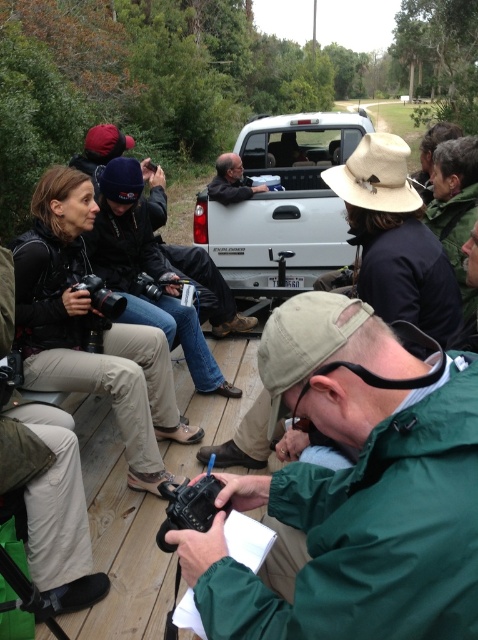
Question: Estimate the real-world distances between objects in this image. Which object is farther from the matte black shirt at center?

Choices:
 (A) green matte jacket at lower right
 (B) black matte camera at lower left

Answer: (A)

Question: Which object appears closest to the camera in this image?

Choices:
 (A) white matte truck at center
 (B) black matte camera at lower left

Answer: (B)

Question: Which object is closer to the camera taking this photo?

Choices:
 (A) black matte camera at lower left
 (B) white matte truck at center

Answer: (A)

Question: Can you confirm if white matte truck at center is positioned to the left of matte black shirt at center?

Choices:
 (A) no
 (B) yes

Answer: (A)

Question: Does matte black shirt at center lie behind black matte camera at lower left?

Choices:
 (A) yes
 (B) no

Answer: (A)

Question: Where is green matte jacket at lower right located in relation to matte black shirt at center in the image?

Choices:
 (A) left
 (B) right

Answer: (B)